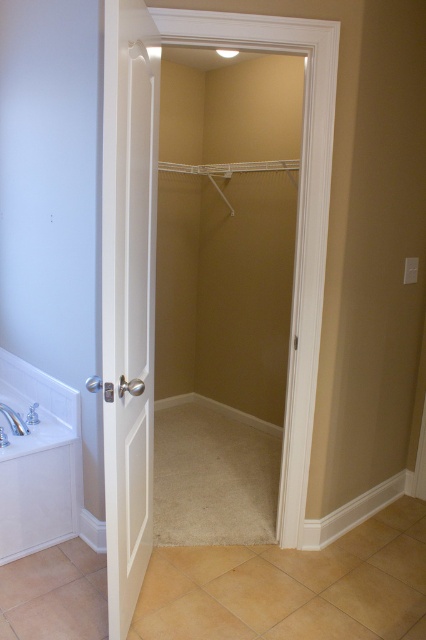
You are a home inspector assessing the bathroom layout. You need to determine if the white glossy bathtub at lower left and the white porcelain sink at lower left are positioned at the same height. Based on the scene, what can you conclude?

The white glossy bathtub at lower left is much taller than the white porcelain sink at lower left, so they are not positioned at the same height.

You are standing in the walk in closet and want to exit through the door. You see the point at coordinate (39,461). Is this point inside the closet or outside the closet?

The point at coordinate (39,461) indicates the white glossy bathtub at lower left, which is located outside the closet. Therefore, the point is outside the closet.

You are a plumber trying to access the pipes under the white glossy bathtub at lower left and the white porcelain sink at lower left. The space between them is narrow. Can you fit through the space between the two fixtures?

The space between the white glossy bathtub at lower left and the white porcelain sink at lower left is only 3.80 inches, which is too narrow for a person to fit through. You will need to find another way to access the pipes.